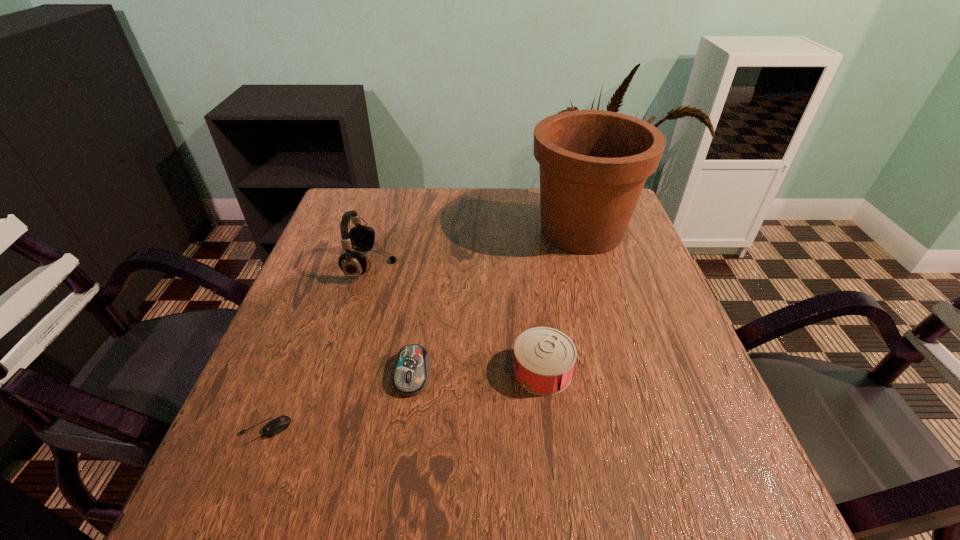
At what (x,y) coordinates should I click in order to perform the action: click on vacant space located on the wheel side of the second shortest object. Please return your answer as a coordinate pair (x, y). This screenshot has height=540, width=960. Looking at the image, I should click on (398, 473).

This screenshot has width=960, height=540. I want to click on free space located 0.210m on the back of the left mouse, so click(x=305, y=329).

Identify the location of object located at the far edge. The width and height of the screenshot is (960, 540). (593, 164).

At what (x,y) coordinates should I click in order to perform the action: click on headset that is at the left edge. Please return your answer as a coordinate pair (x, y). Looking at the image, I should click on (361, 238).

Where is `mouse that is at the left edge`? This screenshot has height=540, width=960. mouse that is at the left edge is located at coordinates (279, 424).

Locate an element on the screen. object located at the right edge is located at coordinates 593,164.

The height and width of the screenshot is (540, 960). What are the coordinates of `object situated at the far right corner` in the screenshot? It's located at (593, 164).

The height and width of the screenshot is (540, 960). I want to click on vacant point at the far edge, so click(533, 190).

Locate an element on the screen. free space at the near edge is located at coordinates (590, 517).

This screenshot has height=540, width=960. I want to click on vacant space at the left edge, so click(x=332, y=352).